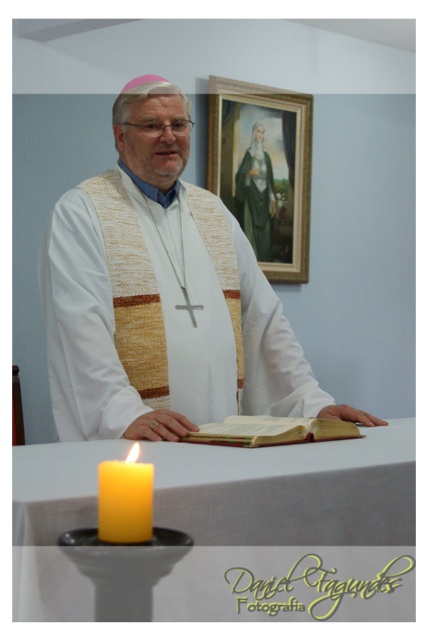
Question: In this image, where is gold-framed painting at upper center located relative to green velvet robe at upper center?

Choices:
 (A) left
 (B) right

Answer: (B)

Question: Which point is farther to the camera?

Choices:
 (A) green velvet robe at upper center
 (B) woven fabric vest at center
 (C) leather-bound book at center

Answer: (A)

Question: Which point appears closest to the camera in this image?

Choices:
 (A) (264, 179)
 (B) (124, 490)
 (C) (300, 97)

Answer: (B)

Question: Does leather-bound book at center appear on the left side of green velvet robe at upper center?

Choices:
 (A) yes
 (B) no

Answer: (A)

Question: Among these objects, which one is nearest to the camera?

Choices:
 (A) leather-bound book at center
 (B) green velvet robe at upper center
 (C) gold-framed painting at upper center
 (D) yellow wax candle at lower left

Answer: (D)

Question: From the image, what is the correct spatial relationship of gold-framed painting at upper center in relation to yellow wax candle at lower left?

Choices:
 (A) right
 (B) left

Answer: (A)